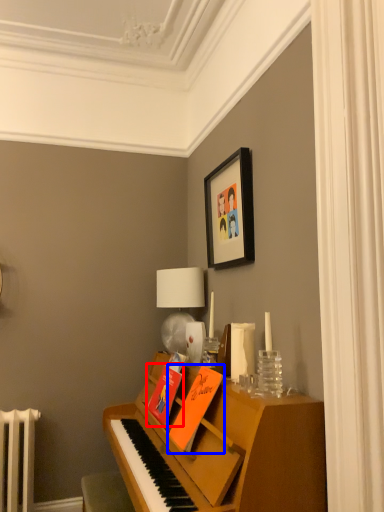
Question: Which object appears closest to the camera in this image, book (highlighted by a red box) or book (highlighted by a blue box)?

Choices:
 (A) book
 (B) book

Answer: (B)